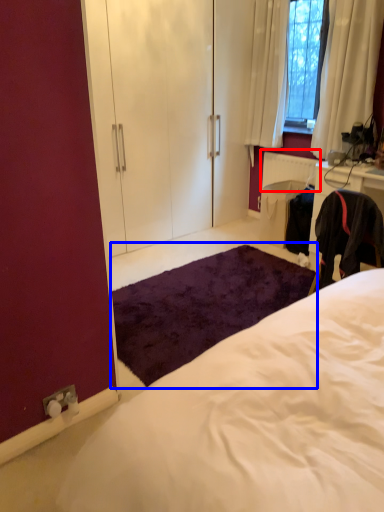
Question: Which object is further to the camera taking this photo, radiator (highlighted by a red box) or mat (highlighted by a blue box)?

Choices:
 (A) radiator
 (B) mat

Answer: (A)